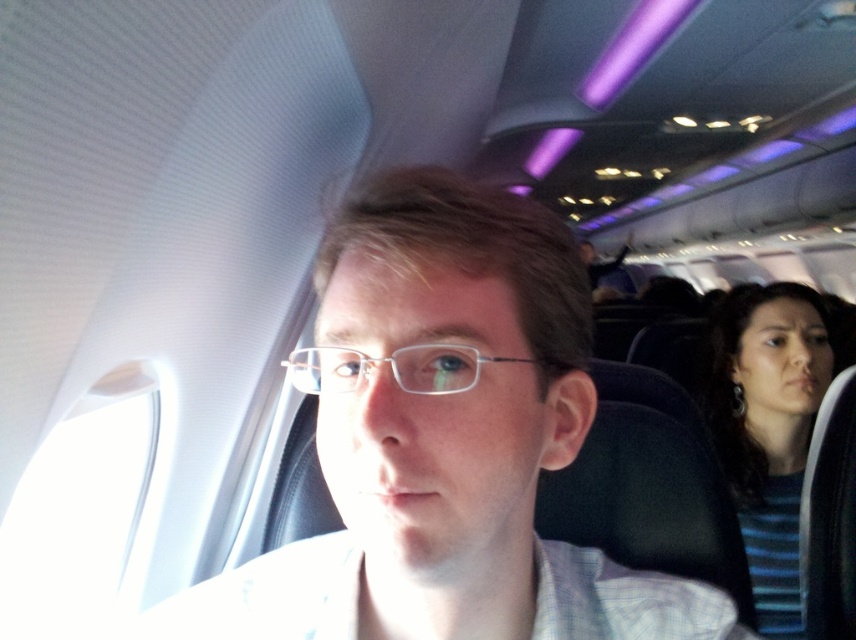
Does matte white shirt at center appear on the right side of clear plastic glasses at center?

Correct, you'll find matte white shirt at center to the right of clear plastic glasses at center.

Which is more to the right, matte white shirt at center or clear plastic glasses at center?

matte white shirt at center

Is point (490, 196) farther from camera compared to point (391, 353)?

Yes, it is behind point (391, 353).

At what (x,y) coordinates should I click in order to perform the action: click on matte white shirt at center. Please return your answer as a coordinate pair (x, y). This screenshot has width=856, height=640. Looking at the image, I should click on (444, 442).

Does blue striped shirt at right have a larger size compared to clear plastic glasses at center?

Correct, blue striped shirt at right is larger in size than clear plastic glasses at center.

Can you confirm if blue striped shirt at right is taller than clear plastic glasses at center?

Yes, blue striped shirt at right is taller than clear plastic glasses at center.

The height and width of the screenshot is (640, 856). Identify the location of blue striped shirt at right. (767, 428).

Is matte white shirt at center taller than blue striped shirt at right?

No.

Which is above, matte white shirt at center or blue striped shirt at right?

Positioned higher is matte white shirt at center.

Is point (339, 298) less distant than point (786, 556)?

That is True.

Locate an element on the screen. This screenshot has width=856, height=640. matte white shirt at center is located at coordinates (444, 442).